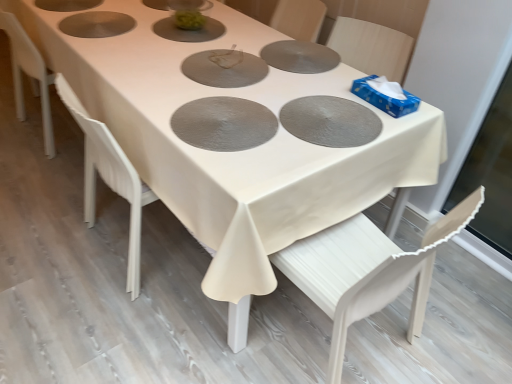
Question: Is white wood chair at lower right looking in the opposite direction of matte gray pizza pan at center, which ranks as the 1th pizza pan in top-to-bottom order?

Choices:
 (A) yes
 (B) no

Answer: (B)

Question: From a real-world perspective, is white wood chair at lower right positioned over matte gray pizza pan at center, which ranks as the third pizza pan in bottom-to-top order, based on gravity?

Choices:
 (A) yes
 (B) no

Answer: (B)

Question: Does white wood chair at lower right touch matte gray pizza pan at center, which ranks as the 1th pizza pan in top-to-bottom order?

Choices:
 (A) no
 (B) yes

Answer: (A)

Question: Is white wood chair at lower right taller than matte gray pizza pan at center, which ranks as the 1th pizza pan in top-to-bottom order?

Choices:
 (A) yes
 (B) no

Answer: (A)

Question: Is white wood chair at lower right further to camera compared to matte gray pizza pan at center, which ranks as the 1th pizza pan in top-to-bottom order?

Choices:
 (A) yes
 (B) no

Answer: (B)

Question: In the image, is textured silver pizza pan at center, arranged as the first pizza pan when ordered from the bottom, on the left side or the right side of matte gray pizza pan at center, which is the second pizza pan in bottom-to-top order?

Choices:
 (A) left
 (B) right

Answer: (A)

Question: Is textured silver pizza pan at center, which is counted as the third pizza pan, starting from the top, inside or outside of matte gray pizza pan at center, which is the second pizza pan in bottom-to-top order?

Choices:
 (A) outside
 (B) inside

Answer: (A)

Question: In terms of height, does textured silver pizza pan at center, which is counted as the third pizza pan, starting from the top, look taller or shorter compared to matte gray pizza pan at center, which is the second pizza pan in bottom-to-top order?

Choices:
 (A) tall
 (B) short

Answer: (B)

Question: Is point (261, 105) closer or farther from the camera than point (320, 125)?

Choices:
 (A) closer
 (B) farther

Answer: (B)

Question: From a real-world perspective, is textured silver pizza pan at center, which is counted as the third pizza pan, starting from the top, physically located above or below matte gray pizza pan at center, which ranks as the 1th pizza pan in top-to-bottom order?

Choices:
 (A) below
 (B) above

Answer: (B)

Question: Would you say textured silver pizza pan at center, which is counted as the third pizza pan, starting from the top, is to the left or to the right of matte gray pizza pan at center, which ranks as the 1th pizza pan in top-to-bottom order, in the picture?

Choices:
 (A) right
 (B) left

Answer: (A)

Question: Does point (252, 105) appear closer or farther from the camera than point (240, 82)?

Choices:
 (A) closer
 (B) farther

Answer: (A)

Question: Considering the positions of textured silver pizza pan at center, which is counted as the third pizza pan, starting from the top, and matte gray pizza pan at center, which ranks as the third pizza pan in bottom-to-top order, in the image, is textured silver pizza pan at center, which is counted as the third pizza pan, starting from the top, bigger or smaller than matte gray pizza pan at center, which ranks as the third pizza pan in bottom-to-top order,?

Choices:
 (A) small
 (B) big

Answer: (B)

Question: Is matte gray pizza pan at center, which ranks as the third pizza pan in bottom-to-top order, in front of or behind textured silver pizza pan at center, which is counted as the third pizza pan, starting from the top, in the image?

Choices:
 (A) behind
 (B) front

Answer: (A)

Question: Would you say matte gray pizza pan at center, which ranks as the third pizza pan in bottom-to-top order, is to the left or to the right of textured silver pizza pan at center, which is counted as the third pizza pan, starting from the top, in the picture?

Choices:
 (A) right
 (B) left

Answer: (B)